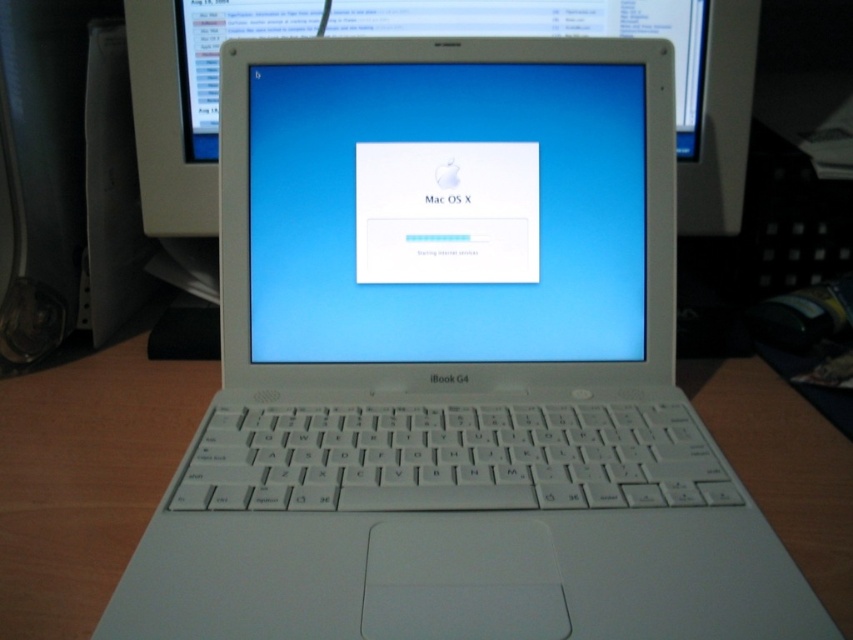
Question: Considering the real-world distances, which object is closest to the wooden table at center?

Choices:
 (A) white glossy screen at center
 (B) white plastic computer monitor at center

Answer: (A)

Question: Is wooden table at center closer to camera compared to white plastic keyboard at center?

Choices:
 (A) yes
 (B) no

Answer: (A)

Question: Is wooden table at center below white plastic keyboard at center?

Choices:
 (A) yes
 (B) no

Answer: (B)

Question: Is white glossy screen at center above white plastic keyboard at center?

Choices:
 (A) yes
 (B) no

Answer: (A)

Question: Which point is farther from the camera taking this photo?

Choices:
 (A) (344, 416)
 (B) (196, 129)

Answer: (B)

Question: Which is farther from the white plastic computer monitor at center?

Choices:
 (A) wooden table at center
 (B) white plastic keyboard at center

Answer: (A)